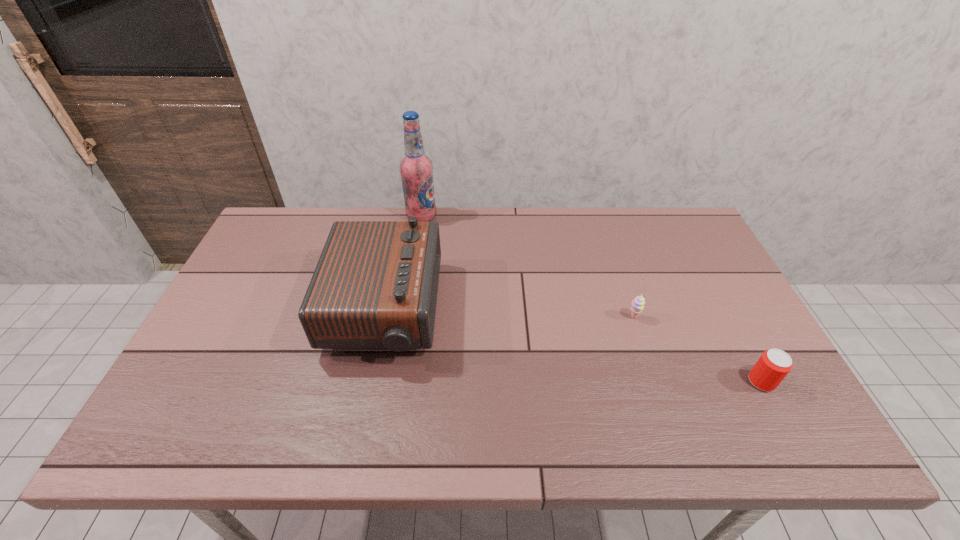
In order to click on vacant region that satisfies the following two spatial constraints: 1. on the tuning display of the radio receiver; 2. on the right side of the beer can in this screenshot , I will do `click(370, 382)`.

What are the coordinates of `blank space that satisfies the following two spatial constraints: 1. on the back side of the beer can; 2. on the tuning display of the radio receiver` in the screenshot? It's located at coord(724,310).

Find the location of a particular element. free spot that satisfies the following two spatial constraints: 1. on the tuning display of the sherbert; 2. on the left side of the radio receiver is located at coordinates tap(383, 318).

The height and width of the screenshot is (540, 960). Find the location of `free spot that satisfies the following two spatial constraints: 1. on the tuning display of the radio receiver; 2. on the left side of the third object from left to right`. free spot that satisfies the following two spatial constraints: 1. on the tuning display of the radio receiver; 2. on the left side of the third object from left to right is located at coordinates (383, 318).

This screenshot has height=540, width=960. Find the location of `vacant region that satisfies the following two spatial constraints: 1. on the tuning display of the third shortest object; 2. on the right side of the rightmost object`. vacant region that satisfies the following two spatial constraints: 1. on the tuning display of the third shortest object; 2. on the right side of the rightmost object is located at coordinates (370, 382).

This screenshot has width=960, height=540. I want to click on vacant area in the image that satisfies the following two spatial constraints: 1. on the tuning display of the radio receiver; 2. on the right side of the beer can, so click(370, 382).